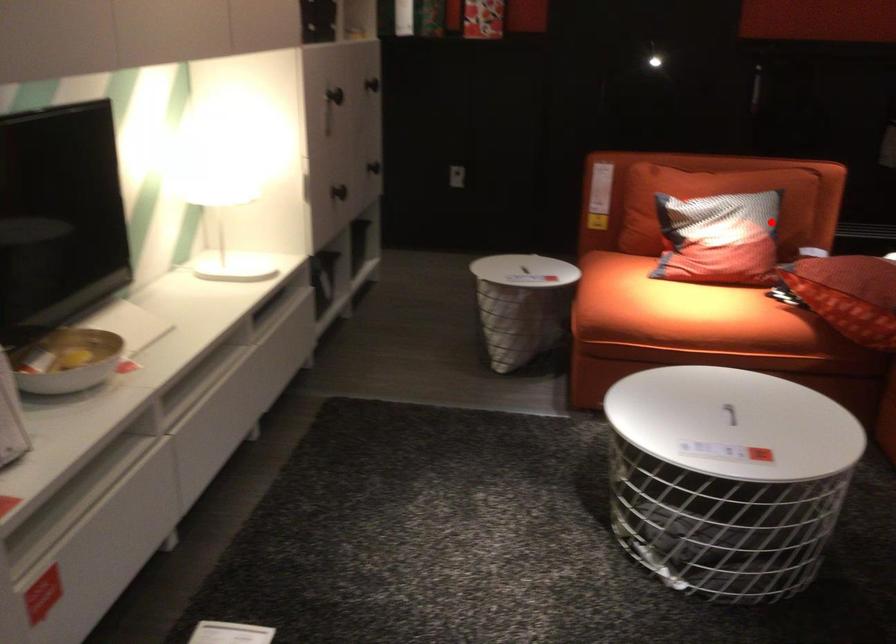
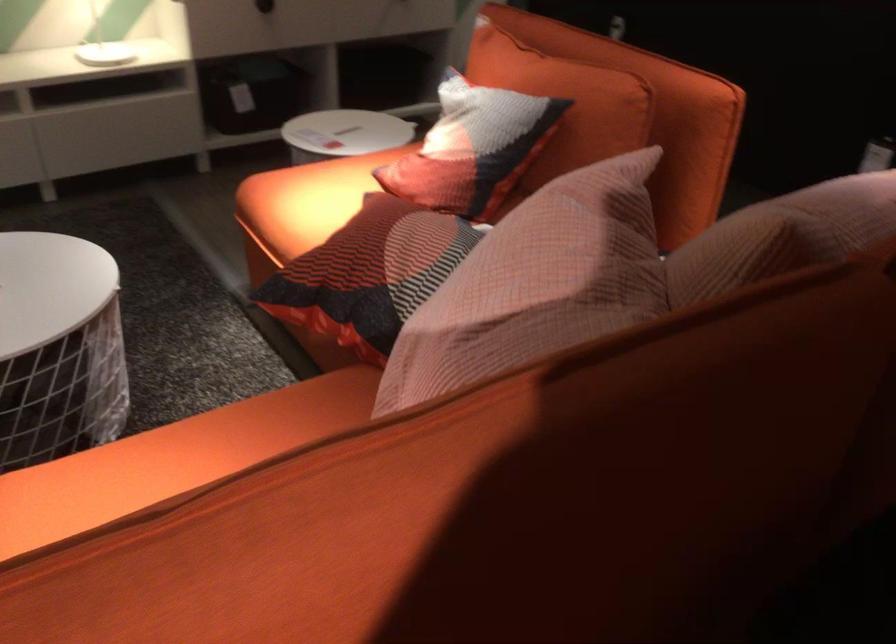
Question: I am providing you with two images of the same scene from different viewpoints. Image1 has a red point marked. In image2, the corresponding 3D location appears at what relative position? Reply with the corresponding letter.

Choices:
 (A) Closer
 (B) Farther

Answer: (A)